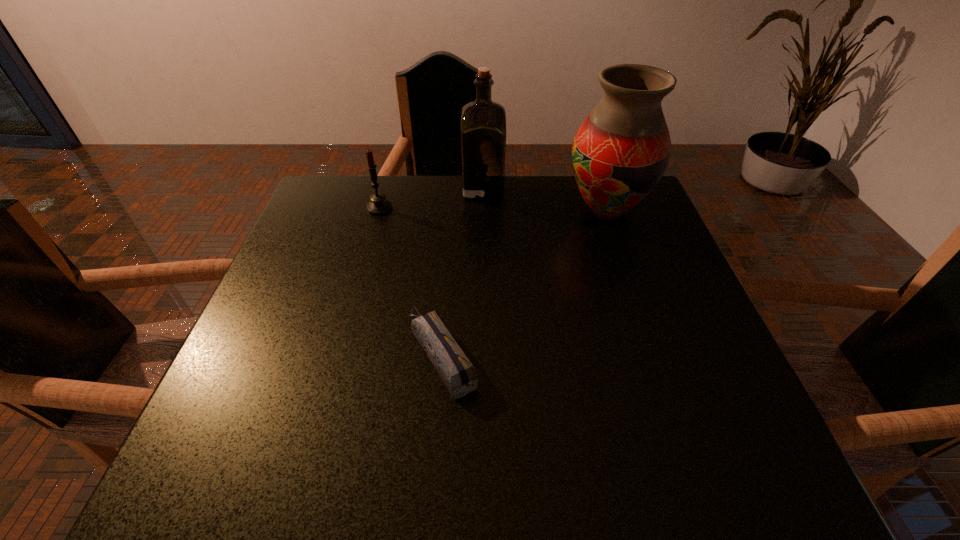
In the image, there is a desktop. Where is `free space at the near edge`? This screenshot has width=960, height=540. free space at the near edge is located at coordinates (507, 455).

The width and height of the screenshot is (960, 540). I want to click on free space at the left edge, so [306, 269].

Image resolution: width=960 pixels, height=540 pixels. In the image, there is a desktop. What are the coordinates of `vacant space at the right edge` in the screenshot? It's located at click(x=656, y=298).

The height and width of the screenshot is (540, 960). In the image, there is a desktop. What are the coordinates of `vacant area at the far left corner` in the screenshot? It's located at (347, 224).

I want to click on vacant space at the near right corner of the desktop, so click(x=754, y=460).

Identify the location of unoccupied area between the nearest object and the liquor. point(463,271).

Where is `blank region between the rightmost object and the liquor`? The width and height of the screenshot is (960, 540). blank region between the rightmost object and the liquor is located at coordinates (544, 199).

Locate an element on the screen. vacant area that lies between the liquor and the vase is located at coordinates (544, 199).

This screenshot has height=540, width=960. In order to click on empty location between the candle and the pencil box in this screenshot , I will do `click(411, 281)`.

I want to click on free space between the liquor and the rightmost object, so click(544, 199).